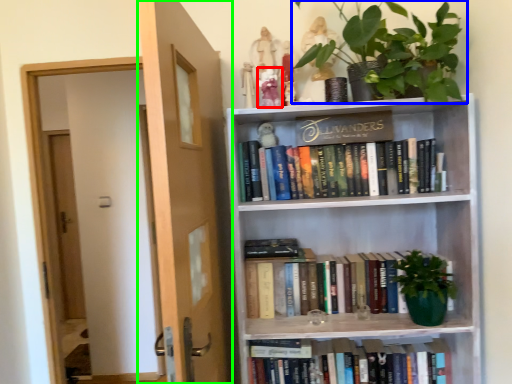
Question: Estimate the real-world distances between objects in this image. Which object is closer to toy (highlighted by a red box), houseplant (highlighted by a blue box) or door (highlighted by a green box)?

Choices:
 (A) houseplant
 (B) door

Answer: (A)